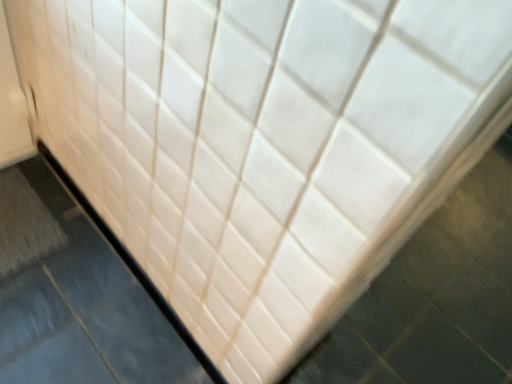
Measure the distance between point (66, 244) and camera.

The depth of point (66, 244) is 1.27 meters.

Describe the element at coordinates (24, 224) in the screenshot. Image resolution: width=512 pixels, height=384 pixels. I see `gray textured bath mat at lower left` at that location.

Where is `gray textured bath mat at lower left`? The image size is (512, 384). gray textured bath mat at lower left is located at coordinates (24, 224).

Describe the element at coordinates (79, 299) in the screenshot. I see `beige glossy slate at lower left` at that location.

Locate an element on the screen. beige glossy slate at lower left is located at coordinates (79, 299).

Find the location of a particular element. This screenshot has height=384, width=512. gray textured bath mat at lower left is located at coordinates (24, 224).

Which object is positioned more to the left, gray textured bath mat at lower left or beige glossy slate at lower left?

From the viewer's perspective, gray textured bath mat at lower left appears more on the left side.

Which object is closer to the camera taking this photo, gray textured bath mat at lower left or beige glossy slate at lower left?

beige glossy slate at lower left is closer to the camera.

Does point (27, 213) come closer to viewer compared to point (78, 375)?

That is False.

From the image's perspective, is gray textured bath mat at lower left located beneath beige glossy slate at lower left?

No, from the image's perspective, gray textured bath mat at lower left is not beneath beige glossy slate at lower left.

From a real-world perspective, which object stands above the other?

In real-world perspective, beige glossy slate at lower left is above.

Is gray textured bath mat at lower left wider or thinner than beige glossy slate at lower left?

Considering their sizes, gray textured bath mat at lower left looks broader than beige glossy slate at lower left.

Considering the sizes of objects gray textured bath mat at lower left and beige glossy slate at lower left in the image provided, who is taller, gray textured bath mat at lower left or beige glossy slate at lower left?

beige glossy slate at lower left is taller.

Considering the relative sizes of gray textured bath mat at lower left and beige glossy slate at lower left in the image provided, is gray textured bath mat at lower left bigger than beige glossy slate at lower left?

Incorrect, gray textured bath mat at lower left is not larger than beige glossy slate at lower left.

Is gray textured bath mat at lower left outside of beige glossy slate at lower left?

That's correct, gray textured bath mat at lower left is outside of beige glossy slate at lower left.

Is gray textured bath mat at lower left not close to beige glossy slate at lower left?

No, gray textured bath mat at lower left is not far from beige glossy slate at lower left.

Is gray textured bath mat at lower left turned away from beige glossy slate at lower left?

gray textured bath mat at lower left does not have its back to beige glossy slate at lower left.

What's the angular difference between gray textured bath mat at lower left and beige glossy slate at lower left's facing directions?

The angle between the facing direction of gray textured bath mat at lower left and the facing direction of beige glossy slate at lower left is 90.6 degrees.

Measure the distance between gray textured bath mat at lower left and beige glossy slate at lower left.

gray textured bath mat at lower left and beige glossy slate at lower left are 12.20 centimeters apart from each other.

What are the coordinates of `slate above the gray textured bath mat at lower left (from a real-world perspective)` in the screenshot? It's located at (79, 299).

Between beige glossy slate at lower left and gray textured bath mat at lower left, which one appears on the left side from the viewer's perspective?

From the viewer's perspective, gray textured bath mat at lower left appears more on the left side.

Which object is closer to the camera, beige glossy slate at lower left or gray textured bath mat at lower left?

Positioned in front is beige glossy slate at lower left.

Which is closer, (55, 218) or (34, 213)?

Point (55, 218) is closer to the camera than point (34, 213).

Based on the photo, from the image's perspective, is beige glossy slate at lower left under gray textured bath mat at lower left?

Correct, beige glossy slate at lower left appears lower than gray textured bath mat at lower left in the image.

From a real-world perspective, who is located higher, beige glossy slate at lower left or gray textured bath mat at lower left?

beige glossy slate at lower left.

Between beige glossy slate at lower left and gray textured bath mat at lower left, which one has larger width?

With larger width is gray textured bath mat at lower left.

Based on the photo, is beige glossy slate at lower left taller or shorter than gray textured bath mat at lower left?

Clearly, beige glossy slate at lower left is taller compared to gray textured bath mat at lower left.

Is beige glossy slate at lower left bigger than gray textured bath mat at lower left?

Indeed, beige glossy slate at lower left has a larger size compared to gray textured bath mat at lower left.

Is beige glossy slate at lower left situated inside gray textured bath mat at lower left or outside?

beige glossy slate at lower left exists outside the volume of gray textured bath mat at lower left.

Is beige glossy slate at lower left placed right next to gray textured bath mat at lower left?

beige glossy slate at lower left and gray textured bath mat at lower left are not in contact.

Is beige glossy slate at lower left positioned with its back to gray textured bath mat at lower left?

No, beige glossy slate at lower left's orientation is not away from gray textured bath mat at lower left.

Can you tell me how much beige glossy slate at lower left and gray textured bath mat at lower left differ in facing direction?

The angle between the facing direction of beige glossy slate at lower left and the facing direction of gray textured bath mat at lower left is 90.6 degrees.

Measure the distance from beige glossy slate at lower left to gray textured bath mat at lower left.

beige glossy slate at lower left and gray textured bath mat at lower left are 4.80 inches apart.

I want to click on bath mat that appears on the left of beige glossy slate at lower left, so click(x=24, y=224).

Locate an element on the screen. The height and width of the screenshot is (384, 512). slate above the gray textured bath mat at lower left (from a real-world perspective) is located at coordinates (79, 299).

Find the location of a particular element. The width and height of the screenshot is (512, 384). slate that is below the gray textured bath mat at lower left (from the image's perspective) is located at coordinates (79, 299).